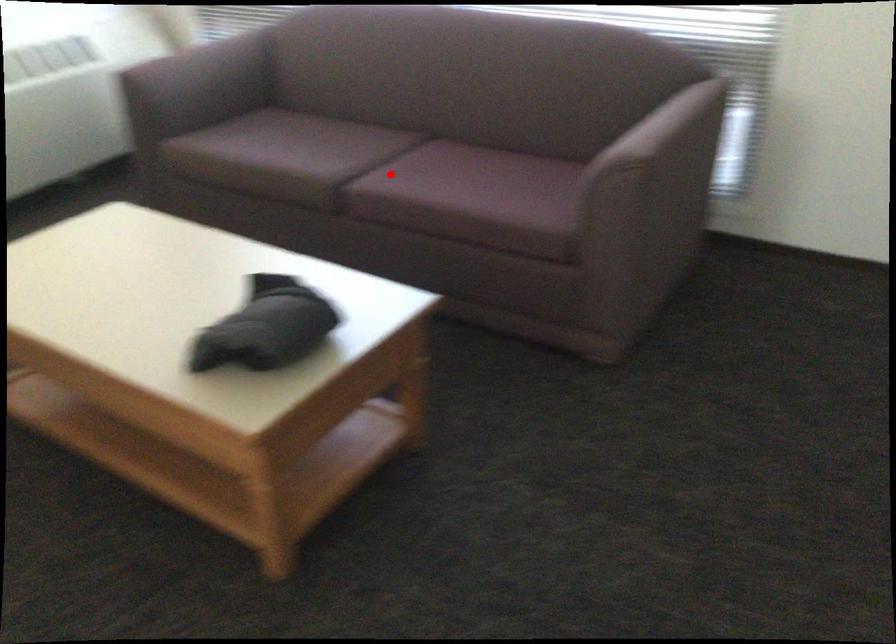
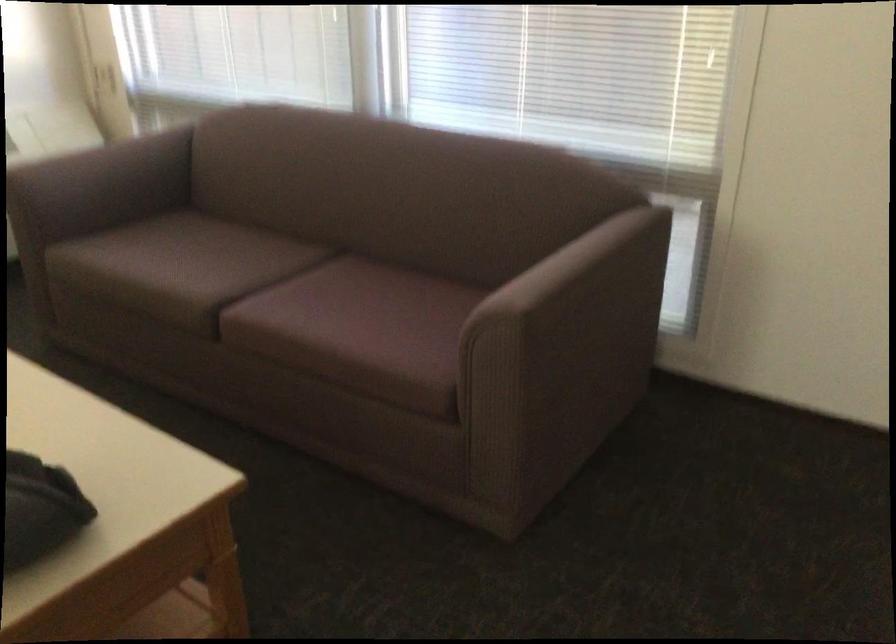
Locate, in the second image, the point that corresponds to the highlighted location in the first image.

(277, 299)